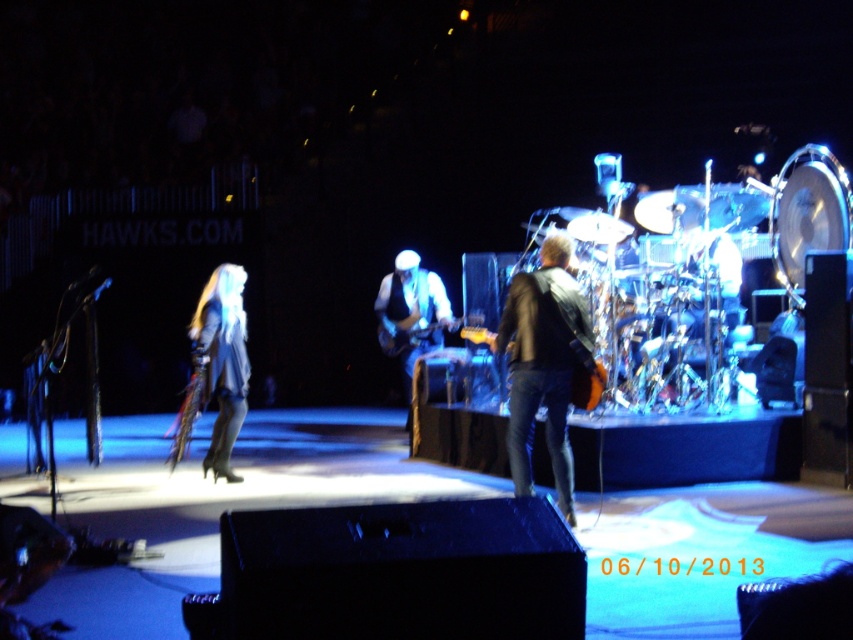
Is shiny silver drum at center right smaller than orange matte guitar at center?

Indeed, shiny silver drum at center right has a smaller size compared to orange matte guitar at center.

Is shiny silver drum at center right to the right of orange matte guitar at center from the viewer's perspective?

Yes, shiny silver drum at center right is to the right of orange matte guitar at center.

Where is `shiny silver drum at center right`? shiny silver drum at center right is located at coordinates (715, 257).

Between satin blue dress at left and shiny silver drum at right, which one is positioned higher?

shiny silver drum at right

Who is more forward, (x=230, y=285) or (x=827, y=163)?

Point (x=230, y=285)

Between point (225, 384) and point (809, 204), which one is positioned behind?

The point (225, 384) is more distant.

You are a GUI agent. You are given a task and a screenshot of the screen. Output one action in this format:
    pyautogui.click(x=<x>, y=<y>)
    Task: Click on the satin blue dress at left
    This screenshot has height=640, width=853.
    Given the screenshot: What is the action you would take?
    pyautogui.click(x=222, y=360)

Based on the photo, does leather jacket at center appear on the right side of satin blue dress at left?

Yes, leather jacket at center is to the right of satin blue dress at left.

Which of these two, leather jacket at center or satin blue dress at left, stands taller?

leather jacket at center

At what (x,y) coordinates should I click in order to perform the action: click on leather jacket at center. Please return your answer as a coordinate pair (x, y). Looking at the image, I should click on (543, 364).

Where is `leather jacket at center`? This screenshot has height=640, width=853. leather jacket at center is located at coordinates (543, 364).